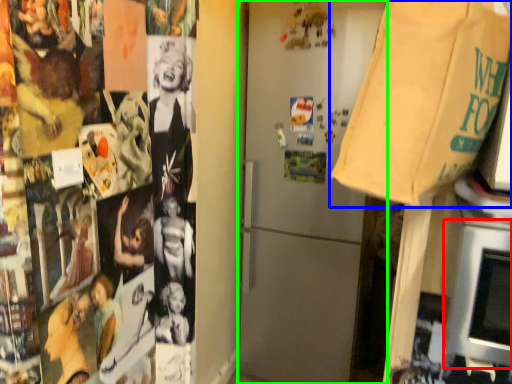
Question: Estimate the real-world distances between objects in this image. Which object is farther from oven (highlighted by a red box), grocery bag (highlighted by a blue box) or refrigerator (highlighted by a green box)?

Choices:
 (A) grocery bag
 (B) refrigerator

Answer: (B)